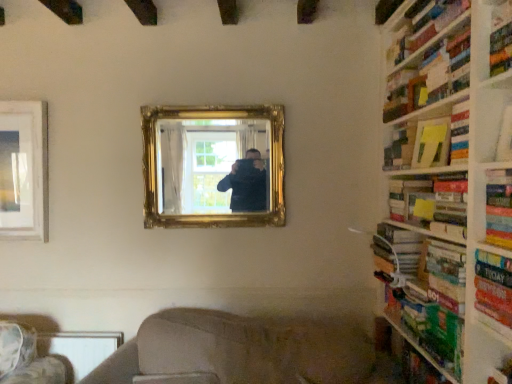
Question: Is hardcover book at right, which is the 5th book from bottom to top, completely or partially outside of hardcover book at right, the second book when ordered from bottom to top?

Choices:
 (A) yes
 (B) no

Answer: (A)

Question: Does hardcover book at right, marked as the second book in a top-to-bottom arrangement, have a greater width compared to hardcover book at right, the second book when ordered from bottom to top?

Choices:
 (A) yes
 (B) no

Answer: (A)

Question: Is hardcover book at right, the second book when ordered from bottom to top, at the back of hardcover book at right, which is the 5th book from bottom to top?

Choices:
 (A) no
 (B) yes

Answer: (A)

Question: Is hardcover book at right, marked as the second book in a top-to-bottom arrangement, behind hardcover book at right, the second book when ordered from bottom to top?

Choices:
 (A) no
 (B) yes

Answer: (A)

Question: From the image's perspective, is hardcover book at right, which is the 5th book from bottom to top, on hardcover book at right, which ranks as the 5th book in top-to-bottom order?

Choices:
 (A) yes
 (B) no

Answer: (A)

Question: Considering the relative sizes of hardcover book at right, which is the 5th book from bottom to top, and hardcover book at right, the second book when ordered from bottom to top, in the image provided, is hardcover book at right, which is the 5th book from bottom to top, thinner than hardcover book at right, the second book when ordered from bottom to top,?

Choices:
 (A) yes
 (B) no

Answer: (B)

Question: Can you confirm if green cardboard bookshelf at right, which is the first shelf from bottom to top, is taller than white paper at upper right, positioned as the 1th shelf in front-to-back order?

Choices:
 (A) yes
 (B) no

Answer: (A)

Question: Is green cardboard bookshelf at right, which is counted as the 3th shelf, starting from the front, oriented towards white paper at upper right, positioned as the 1th shelf in front-to-back order?

Choices:
 (A) yes
 (B) no

Answer: (B)

Question: Does green cardboard bookshelf at right, which ranks as the 3th shelf in top-to-bottom order, appear on the right side of white paper at upper right, arranged as the 3th shelf when viewed from the back?

Choices:
 (A) yes
 (B) no

Answer: (B)

Question: From the image's perspective, would you say green cardboard bookshelf at right, which is counted as the 3th shelf, starting from the front, is positioned over white paper at upper right, the 2th shelf when ordered from top to bottom?

Choices:
 (A) no
 (B) yes

Answer: (A)

Question: Would you say white paper at upper right, arranged as the 3th shelf when viewed from the back, is part of green cardboard bookshelf at right, which is the first shelf from bottom to top,'s contents?

Choices:
 (A) yes
 (B) no

Answer: (B)

Question: From a real-world perspective, does wooden bookshelf at right sit lower than green matte book at right, acting as the 1th book starting from the bottom?

Choices:
 (A) yes
 (B) no

Answer: (B)